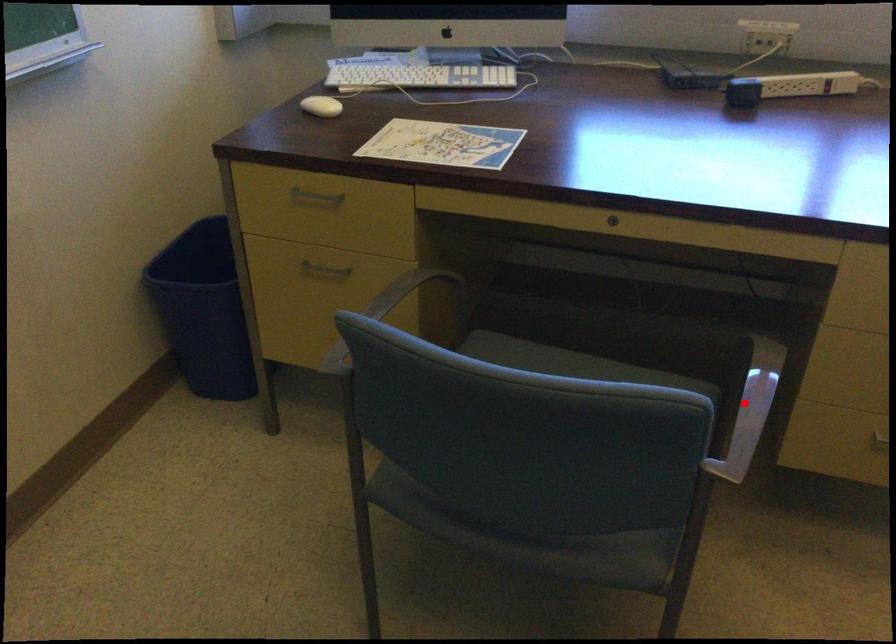
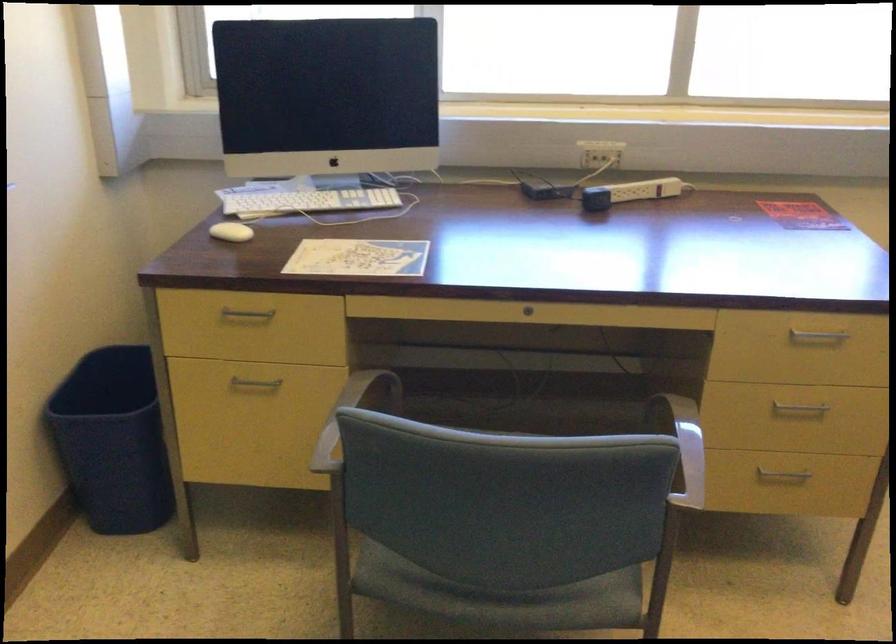
Question: I am providing you with two images of the same scene from different viewpoints. A red point is shown in image1. For the corresponding object point in image2, is it positioned nearer or farther from the camera?

Choices:
 (A) Nearer
 (B) Farther

Answer: (B)